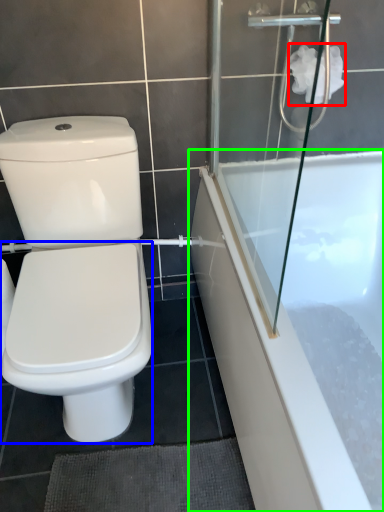
Question: Which object is positioned closest to toilet paper (highlighted by a red box)? Select from bidet (highlighted by a blue box) and bathtub (highlighted by a green box).

Choices:
 (A) bidet
 (B) bathtub

Answer: (B)